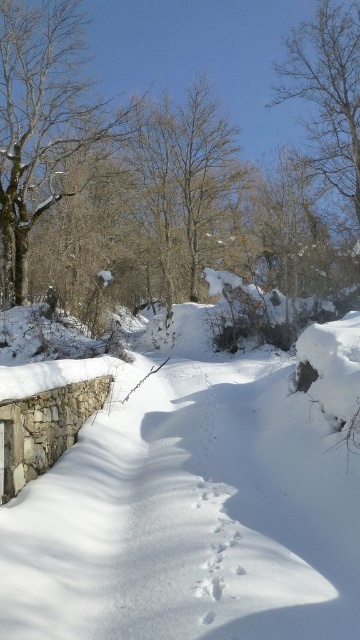
Can you confirm if white powdery snow at center is positioned to the left of brown textured tree at center?

Indeed, white powdery snow at center is positioned on the left side of brown textured tree at center.

Which is behind, point (183, 321) or point (272, 177)?

Positioned behind is point (272, 177).

Identify the location of white powdery snow at center. The height and width of the screenshot is (640, 360). (190, 513).

Measure the distance between white powdery snow at center and brown textured tree at upper right.

A distance of 64.20 feet exists between white powdery snow at center and brown textured tree at upper right.

Between white powdery snow at center and brown textured tree at upper right, which one appears on the right side from the viewer's perspective?

Positioned to the right is brown textured tree at upper right.

Which is in front, point (277, 426) or point (344, 115)?

Point (277, 426)

Find the location of a particular element. Image resolution: width=360 pixels, height=640 pixels. white powdery snow at center is located at coordinates (190, 513).

Is brown textured tree at center thinner than brown textured tree at upper right?

In fact, brown textured tree at center might be wider than brown textured tree at upper right.

Which is below, brown textured tree at center or brown textured tree at upper right?

Positioned lower is brown textured tree at upper right.

What do you see at coordinates (169, 172) in the screenshot?
I see `brown textured tree at center` at bounding box center [169, 172].

Locate an element on the screen. brown textured tree at center is located at coordinates (169, 172).